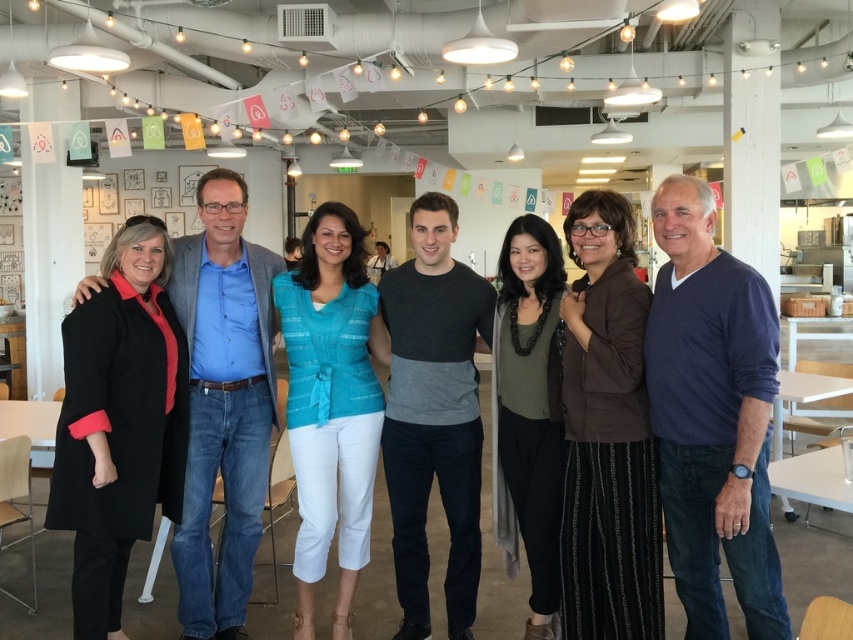
Question: Which point is closer to the camera?

Choices:
 (A) (196, 518)
 (B) (466, 387)
 (C) (664, 492)

Answer: (C)

Question: Which point is farther to the camera?

Choices:
 (A) (422, 480)
 (B) (225, 392)

Answer: (B)

Question: Is black matte coat at left to the right of black cotton shirt at center from the viewer's perspective?

Choices:
 (A) no
 (B) yes

Answer: (A)

Question: Where is dark blue sweater at right located in relation to black cotton shirt at center in the image?

Choices:
 (A) above
 (B) below

Answer: (A)

Question: Where is dark blue sweater at right located in relation to black matte coat at left in the image?

Choices:
 (A) below
 (B) above

Answer: (B)

Question: Which of the following is the farthest from the observer?

Choices:
 (A) (190, 376)
 (B) (741, 429)
 (C) (415, 518)

Answer: (A)